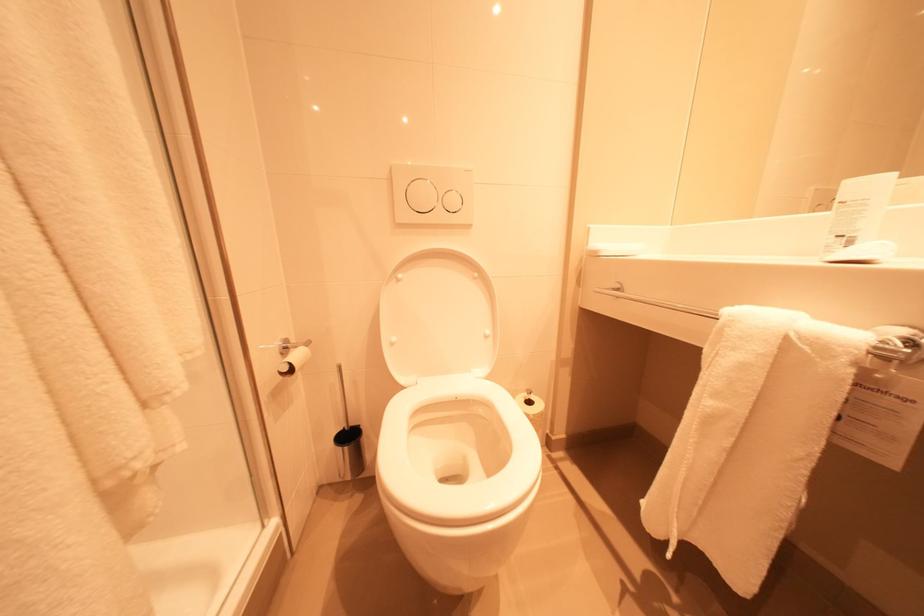
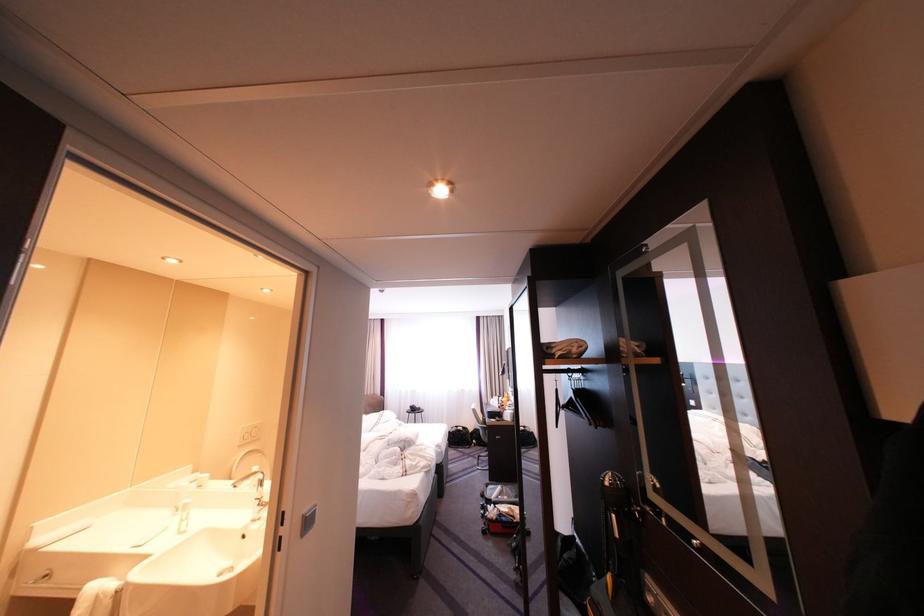
The point at (x=829, y=191) is marked in the first image. Where is the corresponding point in the second image?

(254, 429)